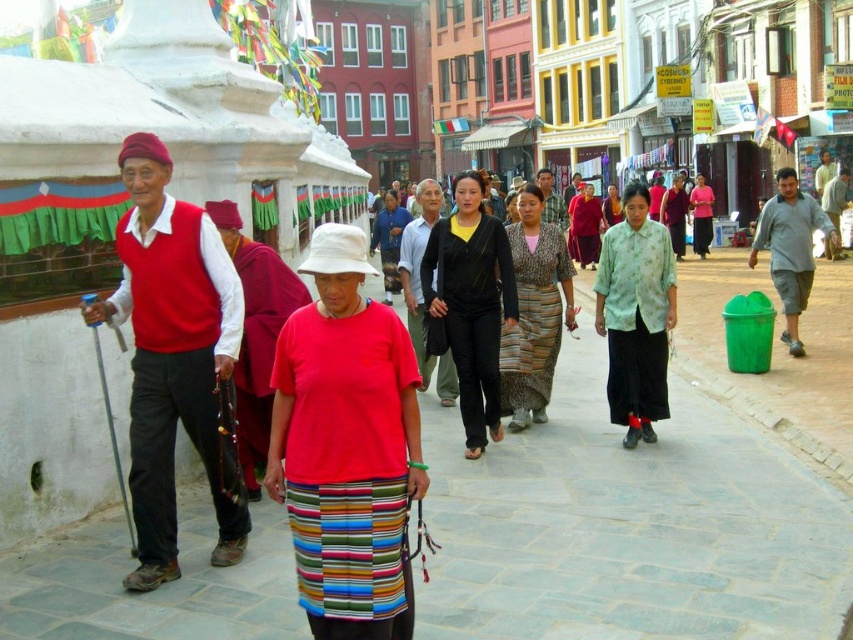
Who is positioned more to the left, red cotton shirt at center or patterned fabric dress at center?

From the viewer's perspective, red cotton shirt at center appears more on the left side.

Image resolution: width=853 pixels, height=640 pixels. Describe the element at coordinates (346, 445) in the screenshot. I see `red cotton shirt at center` at that location.

Locate an element on the screen. Image resolution: width=853 pixels, height=640 pixels. red cotton shirt at center is located at coordinates (346, 445).

Does black matte pants at center have a greater width compared to patterned fabric dress at center?

Yes.

From the picture: Which is below, black matte pants at center or patterned fabric dress at center?

Positioned lower is black matte pants at center.

This screenshot has width=853, height=640. Identify the location of black matte pants at center. (471, 304).

Which is below, gray stone pavement at center or red cotton shirt at center?

gray stone pavement at center is lower down.

Between point (306, 632) and point (299, 468), which one is positioned behind?

Positioned behind is point (306, 632).

This screenshot has width=853, height=640. Describe the element at coordinates (630, 524) in the screenshot. I see `gray stone pavement at center` at that location.

You are a GUI agent. You are given a task and a screenshot of the screen. Output one action in this format:
    pyautogui.click(x=<x>, y=<y>)
    Task: Click on the gray stone pavement at center
    This screenshot has height=640, width=853.
    Given the screenshot: What is the action you would take?
    pyautogui.click(x=630, y=524)